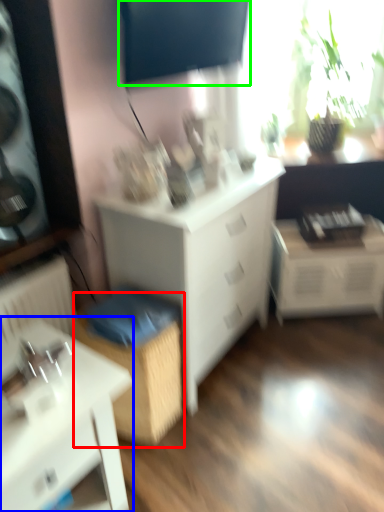
Question: Based on their relative distances, which object is farther from cabinetry (highlighted by a red box)? Choose from table (highlighted by a blue box) and window screen (highlighted by a green box).

Choices:
 (A) table
 (B) window screen

Answer: (B)